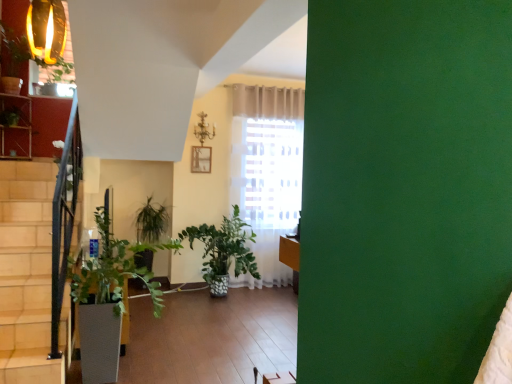
Identify the location of green glossy plant at lower center. The image size is (512, 384). (109, 299).

This screenshot has height=384, width=512. Describe the element at coordinates (109, 299) in the screenshot. I see `green glossy plant at lower center` at that location.

Image resolution: width=512 pixels, height=384 pixels. I want to click on white textured flowerpot at lower left, so click(x=99, y=342).

Describe the element at coordinates (99, 342) in the screenshot. This screenshot has width=512, height=384. I see `white textured flowerpot at lower left` at that location.

Locate an element on the screen. green glossy plant at lower center is located at coordinates (109, 299).

Between green glossy plant at lower center and white textured flowerpot at lower left, which one appears on the left side from the viewer's perspective?

white textured flowerpot at lower left.

Is the position of green glossy plant at lower center less distant than that of white textured flowerpot at lower left?

Yes, green glossy plant at lower center is closer to the viewer.

Considering the points (127, 269) and (96, 335), which point is in front, point (127, 269) or point (96, 335)?

Positioned in front is point (96, 335).

From the image's perspective, which is above, green glossy plant at lower center or white textured flowerpot at lower left?

From the image's view, green glossy plant at lower center is above.

From a real-world perspective, which object stands above the other?

green glossy plant at lower center.

Can you confirm if green glossy plant at lower center is wider than white textured flowerpot at lower left?

Correct, the width of green glossy plant at lower center exceeds that of white textured flowerpot at lower left.

Is green glossy plant at lower center taller or shorter than white textured flowerpot at lower left?

green glossy plant at lower center is taller than white textured flowerpot at lower left.

Based on their sizes in the image, would you say green glossy plant at lower center is bigger or smaller than white textured flowerpot at lower left?

Clearly, green glossy plant at lower center is larger in size than white textured flowerpot at lower left.

Is green glossy plant at lower center not inside white textured flowerpot at lower left?

green glossy plant at lower center lies outside white textured flowerpot at lower left's area.

Is green glossy plant at lower center positioned far away from white textured flowerpot at lower left?

No, green glossy plant at lower center is not far from white textured flowerpot at lower left.

Is green glossy plant at lower center facing towards white textured flowerpot at lower left?

No, green glossy plant at lower center is not facing towards white textured flowerpot at lower left.

Can you tell me how much green glossy plant at lower center and white textured flowerpot at lower left differ in facing direction?

0.000881 degrees.

You are a GUI agent. You are given a task and a screenshot of the screen. Output one action in this format:
    pyautogui.click(x=<x>, y=<y>)
    Task: Click on the flowerpot lying below the green glossy plant at lower center (from the image's perspective)
    The height and width of the screenshot is (384, 512).
    Given the screenshot: What is the action you would take?
    pyautogui.click(x=99, y=342)

Between white textured flowerpot at lower left and green glossy plant at lower center, which one appears on the right side from the viewer's perspective?

green glossy plant at lower center is more to the right.

Is white textured flowerpot at lower left closer to camera compared to green glossy plant at lower center?

No, it is behind green glossy plant at lower center.

Considering the positions of points (100, 349) and (101, 354), is point (100, 349) farther from camera compared to point (101, 354)?

No, (100, 349) is closer to viewer.

From the image's perspective, between white textured flowerpot at lower left and green glossy plant at lower center, which one is located above?

green glossy plant at lower center, from the image's perspective.

From the picture: From a real-world perspective, is white textured flowerpot at lower left above or below green glossy plant at lower center?

white textured flowerpot at lower left is below green glossy plant at lower center.

Between white textured flowerpot at lower left and green glossy plant at lower center, which one has smaller width?

With smaller width is white textured flowerpot at lower left.

Does white textured flowerpot at lower left have a greater height compared to green glossy plant at lower center?

In fact, white textured flowerpot at lower left may be shorter than green glossy plant at lower center.

Can you confirm if white textured flowerpot at lower left is smaller than green glossy plant at lower center?

Correct, white textured flowerpot at lower left occupies less space than green glossy plant at lower center.

Is white textured flowerpot at lower left inside or outside of green glossy plant at lower center?

white textured flowerpot at lower left is inside green glossy plant at lower center.

Are white textured flowerpot at lower left and green glossy plant at lower center located far from each other?

They are positioned close to each other.

Is white textured flowerpot at lower left oriented away from green glossy plant at lower center?

No, white textured flowerpot at lower left is not facing away from green glossy plant at lower center.

What's the angular difference between white textured flowerpot at lower left and green glossy plant at lower center's facing directions?

The angle between the facing direction of white textured flowerpot at lower left and the facing direction of green glossy plant at lower center is 0.000881 degrees.

Where is `houseplant that is above the white textured flowerpot at lower left (from the image's perspective)`? houseplant that is above the white textured flowerpot at lower left (from the image's perspective) is located at coordinates (109, 299).

I want to click on flowerpot on the left of green glossy plant at lower center, so click(x=99, y=342).

Image resolution: width=512 pixels, height=384 pixels. I want to click on houseplant lying above the white textured flowerpot at lower left (from the image's perspective), so click(109, 299).